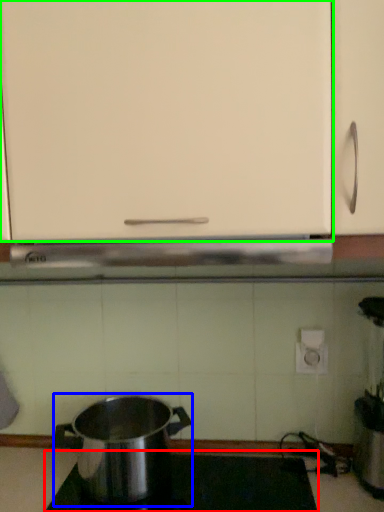
Question: Considering the real-world distances, which object is farthest from gas stove (highlighted by a red box)? kitchen appliance (highlighted by a blue box) or cabinetry (highlighted by a green box)?

Choices:
 (A) kitchen appliance
 (B) cabinetry

Answer: (B)